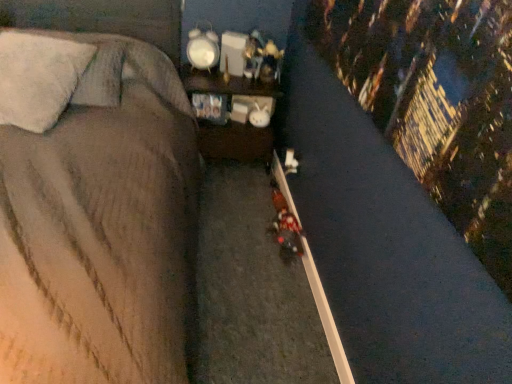
The width and height of the screenshot is (512, 384). Identify the location of wooden shelf at center. (234, 140).

The image size is (512, 384). Describe the element at coordinates (99, 214) in the screenshot. I see `soft gray fabric bed at center` at that location.

Identify the location of shiny plastic toy at center. (262, 59).

From a real-world perspective, is shiny plastic toy at center physically located above or below white fluffy pillow at upper left?

In terms of real-world spatial position, shiny plastic toy at center is above white fluffy pillow at upper left.

Considering the positions of points (280, 60) and (36, 131), is point (280, 60) closer to camera compared to point (36, 131)?

No, it is behind (36, 131).

In the image, is shiny plastic toy at center positioned in front of or behind white fluffy pillow at upper left?

In the image, shiny plastic toy at center appears behind white fluffy pillow at upper left.

From the picture: From the image's perspective, is shiny plastic toy at center under white fluffy pillow at upper left?

Incorrect, from the image's perspective, shiny plastic toy at center is higher than white fluffy pillow at upper left.

The width and height of the screenshot is (512, 384). In order to click on furniture lying on the right of soft gray fabric bed at center in this screenshot , I will do `click(234, 140)`.

Is wooden shelf at center looking in the opposite direction of soft gray fabric bed at center?

wooden shelf at center is not turned away from soft gray fabric bed at center.

Is point (227, 155) closer or farther from the camera than point (117, 67)?

Point (227, 155).

Considering the positions of objects wooden shelf at center and soft gray fabric bed at center in the image provided, who is in front, wooden shelf at center or soft gray fabric bed at center?

soft gray fabric bed at center is more forward.

Which of these two, soft gray fabric bed at center or shiny plastic toy at center, is wider?

soft gray fabric bed at center is wider.

From a real-world perspective, is soft gray fabric bed at center located higher than shiny plastic toy at center?

Actually, soft gray fabric bed at center is physically below shiny plastic toy at center in the real world.

From the image's perspective, which is below, soft gray fabric bed at center or shiny plastic toy at center?

soft gray fabric bed at center is shown below in the image.

Are soft gray fabric bed at center and shiny plastic toy at center making contact?

No, soft gray fabric bed at center is not making contact with shiny plastic toy at center.

Measure the distance from shiny plastic toy at center to wooden shelf at center.

shiny plastic toy at center and wooden shelf at center are 9.21 inches apart from each other.

How many degrees apart are the facing directions of shiny plastic toy at center and wooden shelf at center?

The angular difference between shiny plastic toy at center and wooden shelf at center is 31.9 degrees.

Based on the photo, considering the positions of objects shiny plastic toy at center and wooden shelf at center in the image provided, who is more to the left, shiny plastic toy at center or wooden shelf at center?

wooden shelf at center.

Considering the sizes of shiny plastic toy at center and wooden shelf at center in the image, is shiny plastic toy at center taller or shorter than wooden shelf at center?

Clearly, shiny plastic toy at center is shorter compared to wooden shelf at center.

Is white fluffy pillow at upper left looking in the opposite direction of soft gray fabric bed at center?

Yes, soft gray fabric bed at center is at the back of white fluffy pillow at upper left.

Visually, is white fluffy pillow at upper left positioned to the left or to the right of soft gray fabric bed at center?

white fluffy pillow at upper left is positioned on soft gray fabric bed at center's left side.

In the scene shown: Considering the relative sizes of white fluffy pillow at upper left and soft gray fabric bed at center in the image provided, is white fluffy pillow at upper left taller than soft gray fabric bed at center?

In fact, white fluffy pillow at upper left may be shorter than soft gray fabric bed at center.

From a real-world perspective, who is located lower, soft gray fabric bed at center or white fluffy pillow at upper left?

soft gray fabric bed at center is physically lower.

Does soft gray fabric bed at center appear on the right side of white fluffy pillow at upper left?

Yes.

How different are the orientations of soft gray fabric bed at center and white fluffy pillow at upper left in degrees?

soft gray fabric bed at center and white fluffy pillow at upper left are facing 24.6 degrees away from each other.

From the picture: From the image's perspective, between soft gray fabric bed at center and white fluffy pillow at upper left, which one is located above?

From the image's view, white fluffy pillow at upper left is above.

Between wooden shelf at center and white fluffy pillow at upper left, which one has larger size?

wooden shelf at center.

From a real-world perspective, who is located lower, wooden shelf at center or white fluffy pillow at upper left?

In real-world perspective, wooden shelf at center is lower.

From the image's perspective, relative to white fluffy pillow at upper left, is wooden shelf at center above or below?

Based on their image positions, wooden shelf at center is located beneath white fluffy pillow at upper left.

Between wooden shelf at center and white fluffy pillow at upper left, which one appears on the left side from the viewer's perspective?

Positioned to the left is white fluffy pillow at upper left.

Find the location of a particular element. This screenshot has height=384, width=512. pillow beneath the shiny plastic toy at center (from a real-world perspective) is located at coordinates (38, 78).

Locate an element on the screen. furniture behind the soft gray fabric bed at center is located at coordinates (234, 140).

Looking at this image, based on their spatial positions, is wooden shelf at center or soft gray fabric bed at center closer to shiny plastic toy at center?

Among the two, wooden shelf at center is located nearer to shiny plastic toy at center.

Estimate the real-world distances between objects in this image. Which object is closer to wooden shelf at center, shiny plastic toy at center or white fluffy pillow at upper left?

shiny plastic toy at center.

Which object lies nearer to the anchor point white fluffy pillow at upper left, wooden shelf at center or soft gray fabric bed at center?

The object closer to white fluffy pillow at upper left is soft gray fabric bed at center.

Estimate the real-world distances between objects in this image. Which object is further from wooden shelf at center, white fluffy pillow at upper left or soft gray fabric bed at center?

Based on the image, white fluffy pillow at upper left appears to be further to wooden shelf at center.

Estimate the real-world distances between objects in this image. Which object is closer to wooden shelf at center, soft gray fabric bed at center or white fluffy pillow at upper left?

Among the two, soft gray fabric bed at center is located nearer to wooden shelf at center.

Estimate the real-world distances between objects in this image. Which object is closer to shiny plastic toy at center, white fluffy pillow at upper left or wooden shelf at center?

wooden shelf at center is closer to shiny plastic toy at center.

Estimate the real-world distances between objects in this image. Which object is further from white fluffy pillow at upper left, shiny plastic toy at center or soft gray fabric bed at center?

The object further to white fluffy pillow at upper left is shiny plastic toy at center.

Looking at the image, which one is located further to wooden shelf at center, white fluffy pillow at upper left or shiny plastic toy at center?

Among the two, white fluffy pillow at upper left is located further to wooden shelf at center.

Where is `furniture between white fluffy pillow at upper left and shiny plastic toy at center from left to right`? furniture between white fluffy pillow at upper left and shiny plastic toy at center from left to right is located at coordinates (234, 140).

This screenshot has width=512, height=384. Identify the location of pillow between soft gray fabric bed at center and shiny plastic toy at center from front to back. (38, 78).

The width and height of the screenshot is (512, 384). Find the location of `toy between soft gray fabric bed at center and wooden shelf at center in the front-back direction`. toy between soft gray fabric bed at center and wooden shelf at center in the front-back direction is located at coordinates (262, 59).

The image size is (512, 384). What are the coordinates of `pillow located between soft gray fabric bed at center and wooden shelf at center in the depth direction` in the screenshot? It's located at (38, 78).